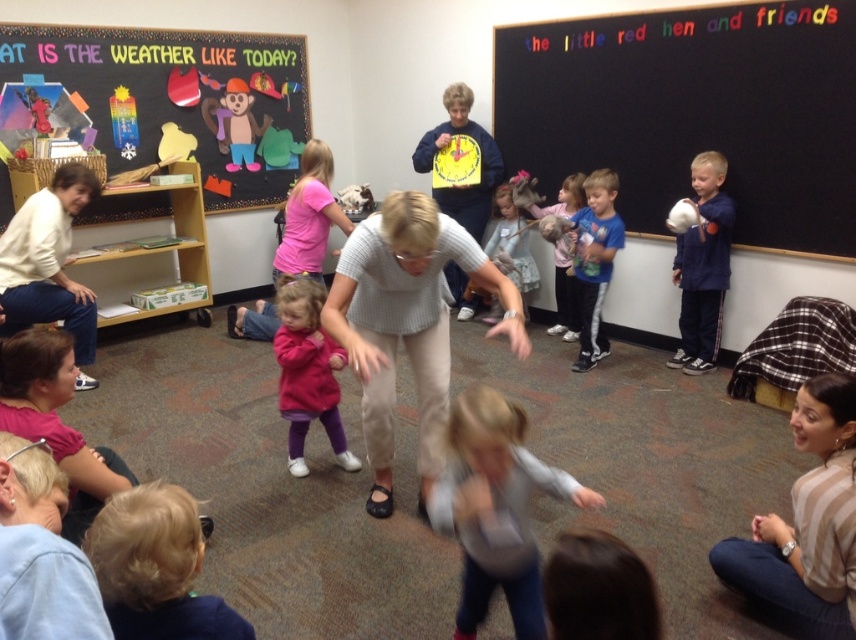
Question: Among these objects, which one is farthest from the camera?

Choices:
 (A) white sweater at left
 (B) light gray sweater at center

Answer: (A)

Question: Is blonde hair at lower left wider than blue cotton shirt at center?

Choices:
 (A) no
 (B) yes

Answer: (B)

Question: Considering the real-world distances, which object is farthest from the pink fabric shirt at center?

Choices:
 (A) multicolored paper weather symbols at upper left
 (B) light gray sweater at center

Answer: (B)

Question: Is white sweater at left below pink fabric shirt at center?

Choices:
 (A) yes
 (B) no

Answer: (A)

Question: Can you confirm if light gray sweater at center is positioned to the right of matte pink sweater at center?

Choices:
 (A) yes
 (B) no

Answer: (B)

Question: Among these points, which one is farthest from the camera?

Choices:
 (A) (66, 320)
 (B) (581, 506)
 (C) (504, 90)
 (D) (363, 376)

Answer: (C)